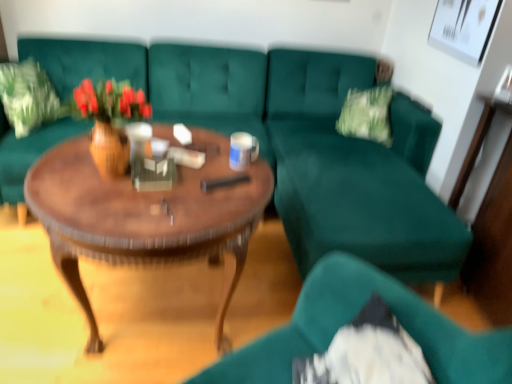
What do you see at coordinates (351, 319) in the screenshot?
I see `teal fabric chair at lower right` at bounding box center [351, 319].

I want to click on wooden vase with flowers at center, so click(x=110, y=121).

Can you see wooden polished coffee table at center touching teal fabric couch at center?

No, wooden polished coffee table at center is not next to teal fabric couch at center.

Is wooden polished coffee table at center at the right side of teal fabric couch at center?

In fact, wooden polished coffee table at center is to the left of teal fabric couch at center.

Where is `coffee table in front of the teal fabric couch at center`? Image resolution: width=512 pixels, height=384 pixels. coffee table in front of the teal fabric couch at center is located at coordinates (145, 215).

Which point is more distant from viewer, (76, 203) or (85, 65)?

The point (85, 65) is more distant.

From the image's perspective, is teal fabric couch at center located beneath teal fabric chair at lower right?

No.

Is teal fabric couch at center facing away from teal fabric chair at lower right?

No, teal fabric chair at lower right is not at the back of teal fabric couch at center.

Consider the image. In terms of width, does teal fabric couch at center look wider or thinner when compared to teal fabric chair at lower right?

In the image, teal fabric couch at center appears to be wider than teal fabric chair at lower right.

Is wooden polished coffee table at center inside the boundaries of green fabric pillow at upper left, or outside?

wooden polished coffee table at center cannot be found inside green fabric pillow at upper left.

Which object is more forward, wooden polished coffee table at center or green fabric pillow at upper left?

wooden polished coffee table at center is in front.

Which of these two, wooden polished coffee table at center or green fabric pillow at upper left, is smaller?

green fabric pillow at upper left is smaller.

Is point (234, 242) less distant than point (28, 126)?

That is True.

From the image's perspective, is green fabric pillow at upper left below wooden polished coffee table at center?

No, from the image's perspective, green fabric pillow at upper left is not beneath wooden polished coffee table at center.

Would you say wooden polished coffee table at center is part of green fabric pillow at upper left's contents?

Definitely not — wooden polished coffee table at center is not inside green fabric pillow at upper left.

Is green fabric pillow at upper left at the left side of wooden polished coffee table at center?

Yes.

Is point (30, 69) closer or farther from the camera than point (42, 216)?

Point (30, 69) is positioned farther from the camera compared to point (42, 216).

How many degrees apart are the facing directions of wooden polished coffee table at center and teal fabric chair at lower right?

75.8 degrees separate the facing orientations of wooden polished coffee table at center and teal fabric chair at lower right.

Can you confirm if wooden polished coffee table at center is thinner than teal fabric chair at lower right?

In fact, wooden polished coffee table at center might be wider than teal fabric chair at lower right.

Does wooden polished coffee table at center appear on the left side of teal fabric chair at lower right?

Correct, you'll find wooden polished coffee table at center to the left of teal fabric chair at lower right.

Considering the points (77, 173) and (443, 368), which point is in front, point (77, 173) or point (443, 368)?

The point (443, 368) is closer to the camera.

Is green fabric pillow at upper left positioned far away from wooden vase with flowers at center?

That's right, there is a large distance between green fabric pillow at upper left and wooden vase with flowers at center.

Considering the sizes of objects green fabric pillow at upper left and wooden vase with flowers at center in the image provided, who is shorter, green fabric pillow at upper left or wooden vase with flowers at center?

Standing shorter between the two is wooden vase with flowers at center.

In the scene shown: Which of these two, green fabric pillow at upper left or wooden vase with flowers at center, is thinner?

Thinner between the two is wooden vase with flowers at center.

Is teal fabric couch at center not within wooden polished coffee table at center?

Indeed, teal fabric couch at center is completely outside wooden polished coffee table at center.

Identify the location of studio couch above the wooden polished coffee table at center (from a real-world perspective). (295, 143).

Is teal fabric couch at center oriented towards wooden polished coffee table at center?

Yes.

Between teal fabric couch at center and wooden polished coffee table at center, which one has less height?

With less height is wooden polished coffee table at center.

This screenshot has height=384, width=512. I want to click on studio couch above the wooden polished coffee table at center (from a real-world perspective), so click(295, 143).

Identify the location of chair on the right of teal fabric couch at center. (351, 319).

Looking at the image, which one is located further to wooden polished coffee table at center, wooden vase with flowers at center or teal fabric couch at center?

teal fabric couch at center.

Considering their positions, is wooden vase with flowers at center positioned further to wooden polished coffee table at center than teal fabric chair at lower right?

The object further to wooden polished coffee table at center is teal fabric chair at lower right.

Estimate the real-world distances between objects in this image. Which object is closer to teal fabric couch at center, teal fabric chair at lower right or wooden vase with flowers at center?

teal fabric chair at lower right is positioned closer to the anchor teal fabric couch at center.

Which object lies nearer to the anchor point teal fabric couch at center, green fabric pillow at upper left or wooden vase with flowers at center?

Among the two, green fabric pillow at upper left is located nearer to teal fabric couch at center.

Looking at the image, which one is located closer to wooden polished coffee table at center, green fabric pillow at upper left or teal fabric couch at center?

teal fabric couch at center is positioned closer to the anchor wooden polished coffee table at center.

Based on their spatial positions, is teal fabric chair at lower right or green fabric pillow at upper left closer to wooden polished coffee table at center?

The object closer to wooden polished coffee table at center is teal fabric chair at lower right.

Looking at the image, which one is located closer to teal fabric chair at lower right, wooden vase with flowers at center or wooden polished coffee table at center?

wooden polished coffee table at center.

When comparing their distances from teal fabric chair at lower right, does wooden polished coffee table at center or wooden vase with flowers at center seem further?

Based on the image, wooden vase with flowers at center appears to be further to teal fabric chair at lower right.

You are a GUI agent. You are given a task and a screenshot of the screen. Output one action in this format:
    pyautogui.click(x=<x>, y=<y>)
    Task: Click on the studio couch between green fabric pillow at upper left and teal fabric chair at lower right in the horizontal direction
    
    Given the screenshot: What is the action you would take?
    pyautogui.click(x=295, y=143)

I want to click on coffee table between green fabric pillow at upper left and teal fabric couch at center, so click(x=145, y=215).

The width and height of the screenshot is (512, 384). What are the coordinates of `coffee table located between green fabric pillow at upper left and teal fabric chair at lower right in the left-right direction` in the screenshot? It's located at (145, 215).

Find the location of a particular element. Image resolution: width=512 pixels, height=384 pixels. coffee table between teal fabric couch at center and teal fabric chair at lower right from top to bottom is located at coordinates (145, 215).